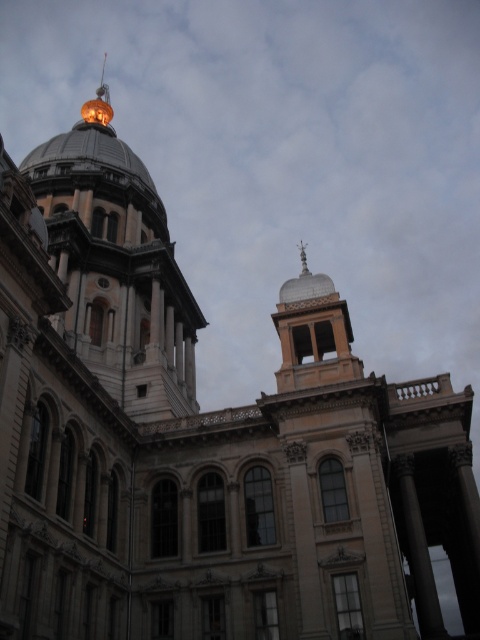
Can you confirm if shiny gold dome at upper left is wider than silver metallic dome at upper center?

Indeed, shiny gold dome at upper left has a greater width compared to silver metallic dome at upper center.

Can you confirm if shiny gold dome at upper left is positioned to the right of silver metallic dome at upper center?

Incorrect, shiny gold dome at upper left is not on the right side of silver metallic dome at upper center.

Where is `shiny gold dome at upper left`? Image resolution: width=480 pixels, height=640 pixels. shiny gold dome at upper left is located at coordinates (117, 266).